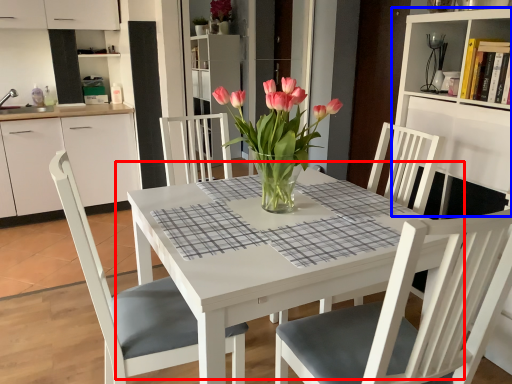
Question: Which of the following is the farthest to the observer, kitchen & dining room table (highlighted by a red box) or bookshelf (highlighted by a blue box)?

Choices:
 (A) kitchen & dining room table
 (B) bookshelf

Answer: (B)